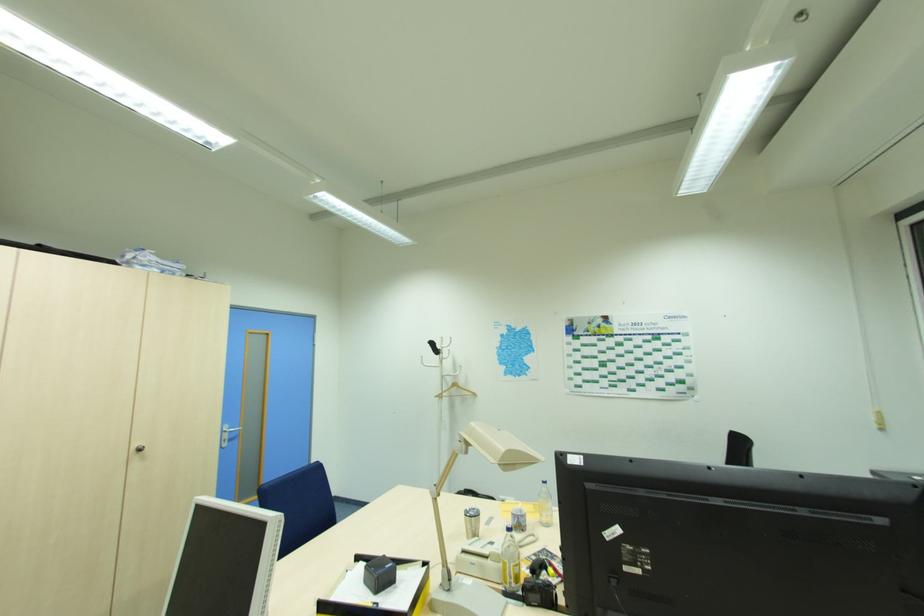
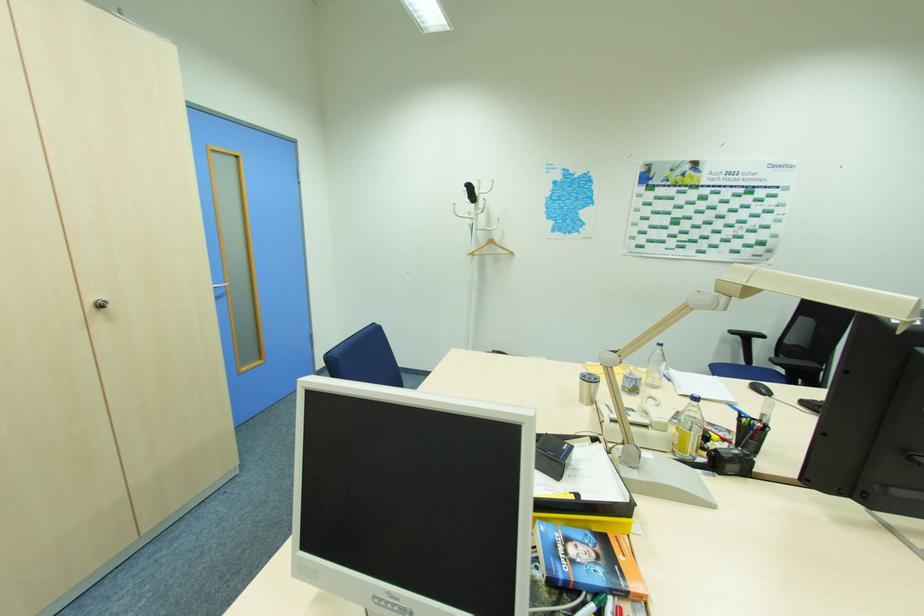
The point at (434, 344) is marked in the first image. Where is the corresponding point in the second image?

(472, 188)